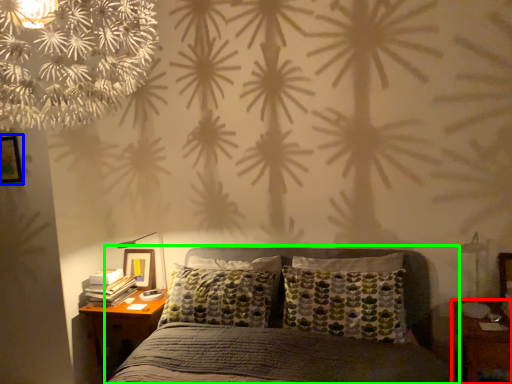
Question: Considering the real-world distances, which object is closest to nightstand (highlighted by a red box)? picture frame (highlighted by a blue box) or bed (highlighted by a green box).

Choices:
 (A) picture frame
 (B) bed

Answer: (B)